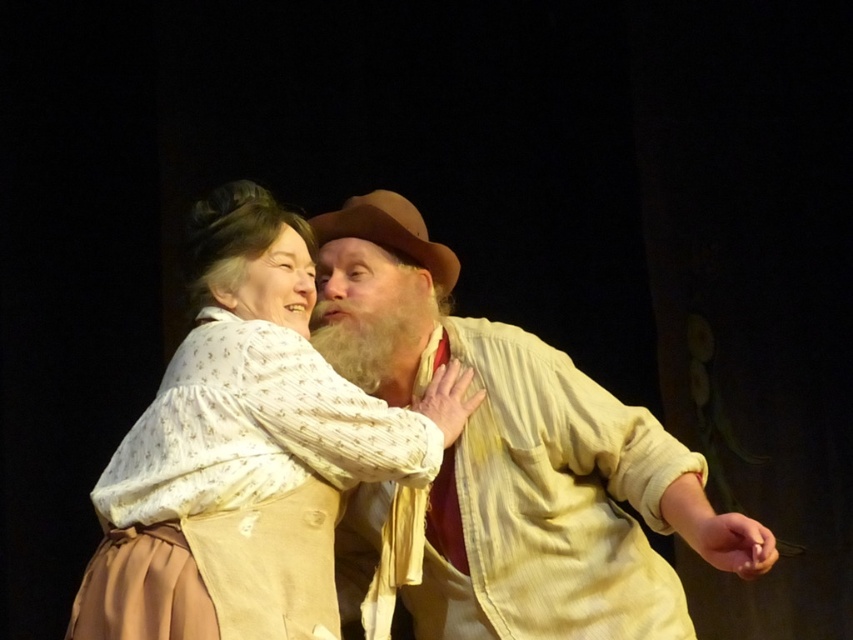
You are a costume designer reviewing a play scene. The director wants to ensure that the beige textured shirt at center and the matte white blouse at center are proportionate to their respective actors. Based on the image, which costume might need adjustments to better match the actor it belongs to?

The beige textured shirt at center is bigger than the matte white blouse at center. Since the beige textured shirt is larger, it might need adjustments to ensure it fits properly on its actor, while the smaller matte white blouse may already be appropriately sized.

You are an audience member sitting in the front row of the theater. You notice two points marked on the stage. The first point is at coordinate point (564, 486) and the second is at point (372, 236). Which point appears closer to you?

Point (564, 486) is closer to the camera than point (372, 236), so the first point appears closer to you.

You are a stagehand setting up a spotlight for a play. The spotlight has a 70 cm diameter beam. You need to ensure that both the matte white blouse at center and the brown felt cowboy hat at center are fully illuminated. Is the spotlight beam large enough to cover both objects?

The matte white blouse at center and the brown felt cowboy hat at center are 68.81 centimeters apart from each other. Since the spotlight beam has a 70 cm diameter, which is slightly larger than the distance between them, the beam can fully illuminate both objects.